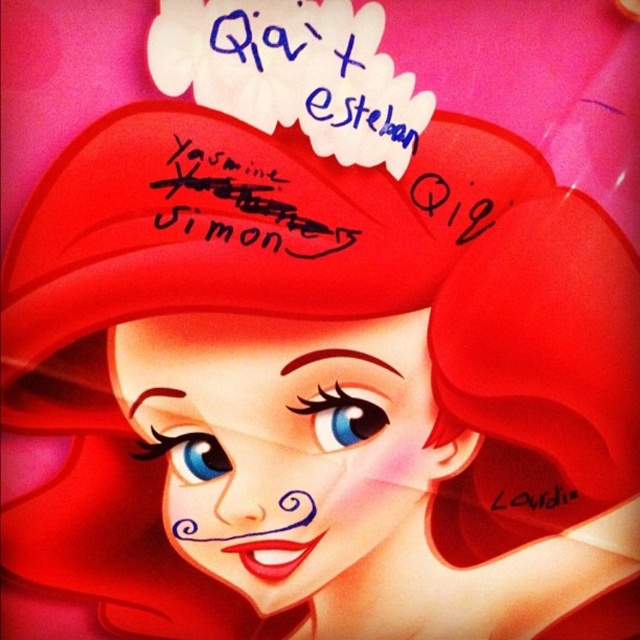
Question: Which object is the farthest from the black ink signature at center?

Choices:
 (A) blue ink signature at upper center
 (B) matte red hair at center

Answer: (B)

Question: Based on their relative distances, which object is nearer to the black ink signature at center?

Choices:
 (A) blue ink signature at upper center
 (B) matte red hair at center

Answer: (A)

Question: Which object appears farthest from the camera in this image?

Choices:
 (A) matte red hair at center
 (B) blue ink signature at upper center

Answer: (A)

Question: Is blue ink signature at upper center bigger than black ink signature at center?

Choices:
 (A) no
 (B) yes

Answer: (B)

Question: Is blue ink signature at upper center thinner than black ink signature at center?

Choices:
 (A) yes
 (B) no

Answer: (B)

Question: Can you confirm if blue ink signature at upper center is positioned to the right of black ink signature at center?

Choices:
 (A) no
 (B) yes

Answer: (B)